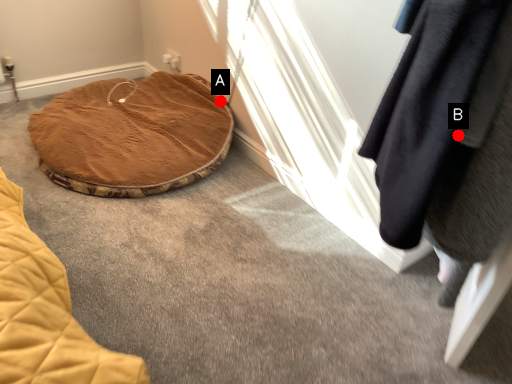
Question: Two points are circled on the image, labeled by A and B beside each circle. Which of the following is the closest to the observer?

Choices:
 (A) A is closer
 (B) B is closer

Answer: (B)